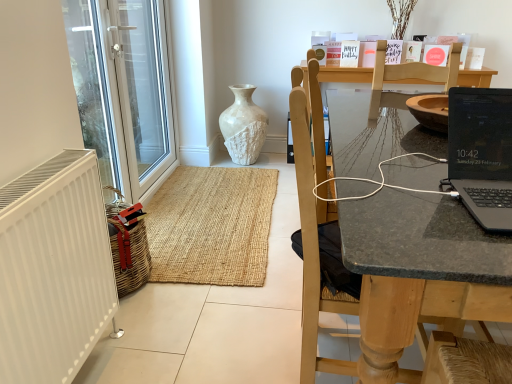
At what (x,y) coordinates should I click in order to perform the action: click on free spot to the left of black glossy laptop at right. Please return your answer as a coordinate pair (x, y). Looking at the image, I should click on (402, 203).